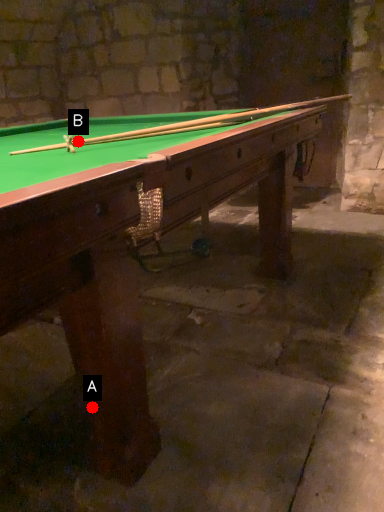
Question: Two points are circled on the image, labeled by A and B beside each circle. Which point is further to the camera?

Choices:
 (A) A is further
 (B) B is further

Answer: (B)